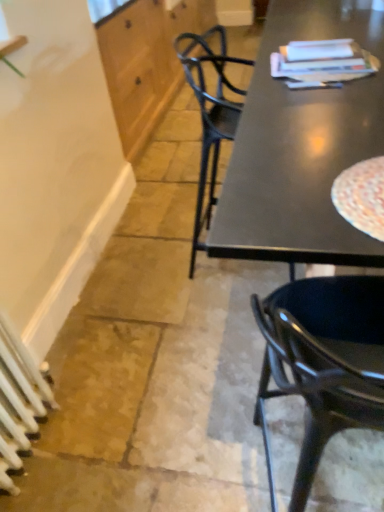
Question: From a real-world perspective, is white wood cabinet at upper left positioned above or below glossy black chair at right?

Choices:
 (A) below
 (B) above

Answer: (A)

Question: From the image's perspective, relative to glossy black chair at right, is white wood cabinet at upper left above or below?

Choices:
 (A) above
 (B) below

Answer: (A)

Question: Which is nearer to the glossy black chair at right?

Choices:
 (A) white wood cabinet at upper left
 (B) white metallic radiator at lower left

Answer: (B)

Question: Which object is positioned closest to the white metallic radiator at lower left?

Choices:
 (A) white wood cabinet at upper left
 (B) glossy black chair at right

Answer: (B)